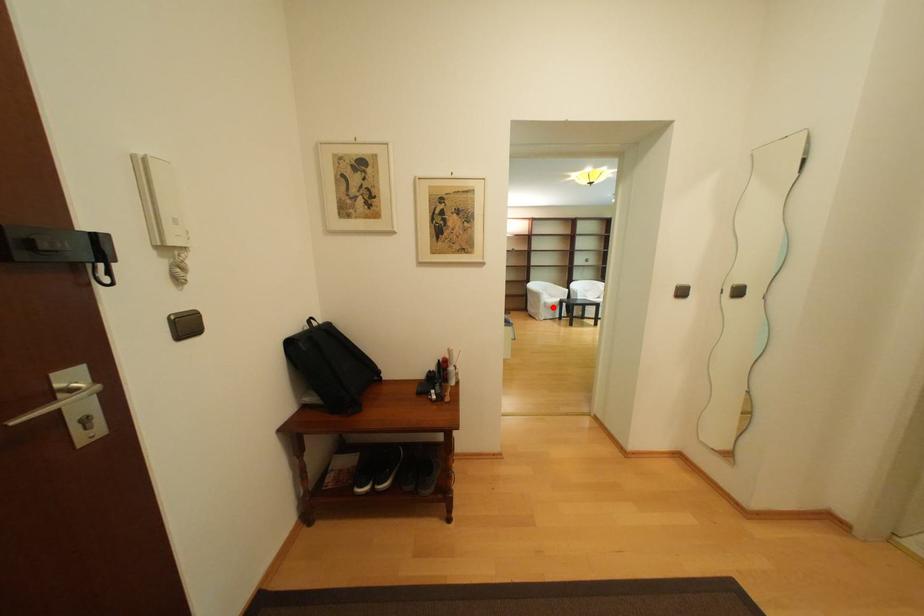
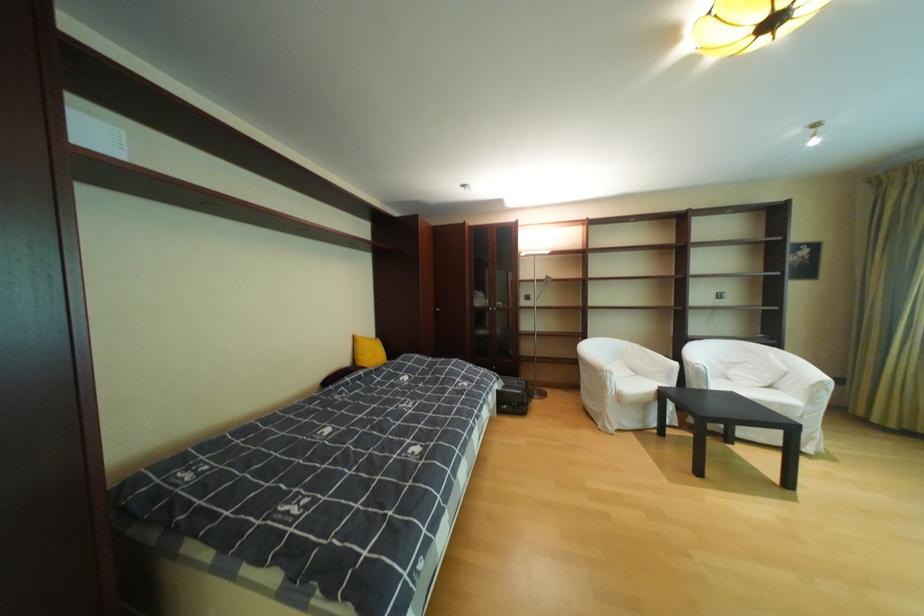
Find the pixel in the second image that matches the highlighted location in the first image.

(621, 402)